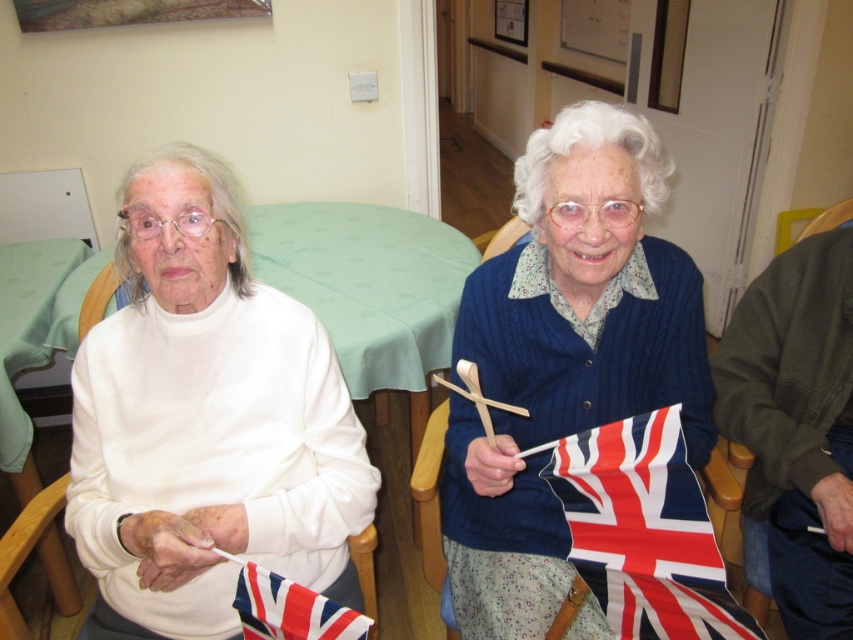
You are standing in the room where the two women are seated. You notice two points marked on the floor at coordinates point [612,627] and point [3,577]. If you were to walk from the first point to the second, would you be moving towards the wall or away from it?

Since point [612,627] is in front of point [3,577], moving from the first to the second point means you are moving away from the wall.

You are a photographer adjusting the focus on your camera. You notice two points in the image at coordinates point (152, 276) and point (669, 362). Which point should you focus on first to ensure the closest object is sharp?

Point (152, 276) is closer to the viewer than point (669, 362), so you should focus on point (152, 276) first to ensure the closest object is sharp.